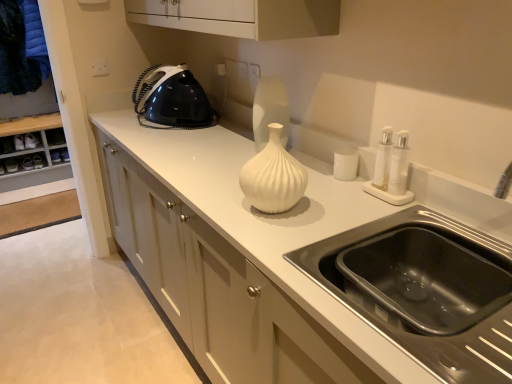
Question: From the image's perspective, is white matte cup at center above or below black stainless steel sink at lower right?

Choices:
 (A) below
 (B) above

Answer: (B)

Question: Is point (352, 165) closer or farther from the camera than point (356, 301)?

Choices:
 (A) closer
 (B) farther

Answer: (B)

Question: Considering the real-world distances, which object is farthest from the white matte vase at center?

Choices:
 (A) white plastic electric outlet at center, which is the 2th electric outlet in back-to-front order
 (B) white glossy cabinet at center
 (C) white plastic electric outlet at upper center, the 2th electric outlet from the right
 (D) black plastic iron at upper left
 (E) dark blue fabric at left

Answer: (E)

Question: Which is farther from the white glossy cabinet at center?

Choices:
 (A) white plastic electric outlet at upper center, acting as the 2th electric outlet starting from the bottom
 (B) dark blue fabric at left
 (C) black stainless steel sink at lower right
 (D) white matte cup at center
 (E) white plastic electric outlet at center, the first electric outlet positioned from the right

Answer: (B)